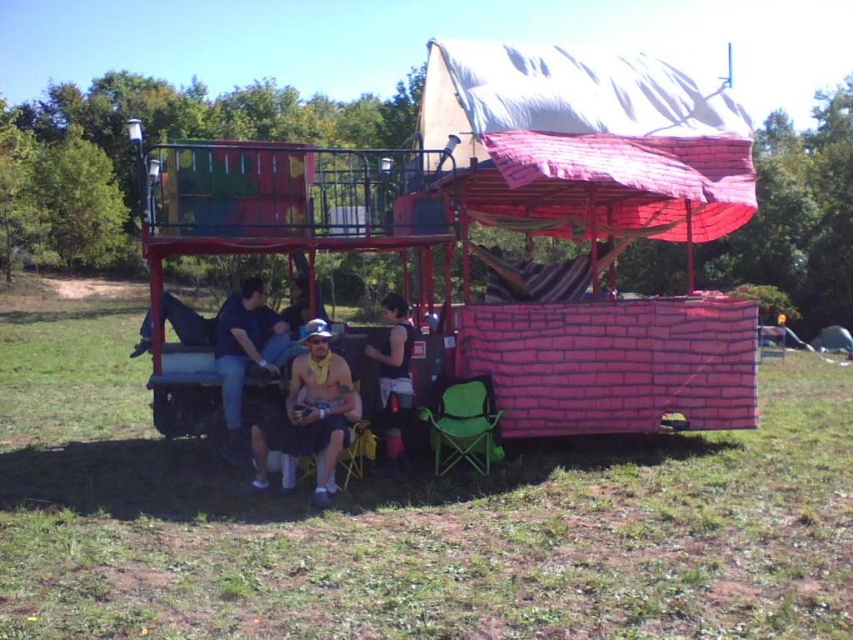
You are a photographer trying to capture a closeup shot of the green fabric chair at lower center and the black fabric bag at center in the image. Can you fit both objects in your camera frame if the maximum distance your camera can accommodate between two objects is 20 inches?

The green fabric chair at lower center and black fabric bag at center are 21.05 inches apart from each other. Since the distance between them exceeds the camera frame limit of 20 inches, you cannot fit both objects in the frame.

You are organizing a small outdoor event and need to place the green fabric chair at lower center and the black fabric bag at center in a specific area. Which object takes up more space and should be considered first for placement?

The black fabric bag at center occupies more space than the green fabric chair at lower center, so it should be considered first for placement.

You are standing on the platform of the colorful train car structure and need to reach the dark blue jeans at lower center and the green fabric chair at lower center. Which object is closer to you?

The dark blue jeans at lower center is 5.18 feet away from the green fabric chair at lower center, so the distance between them is 5.18 feet. However, without knowing your exact position on the platform, it is impossible to determine which one is closer to you.